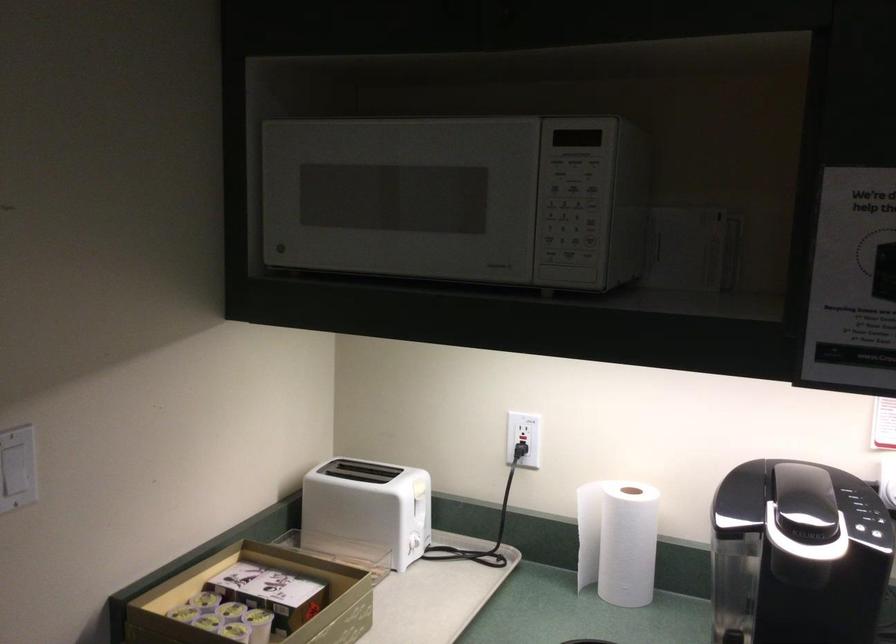
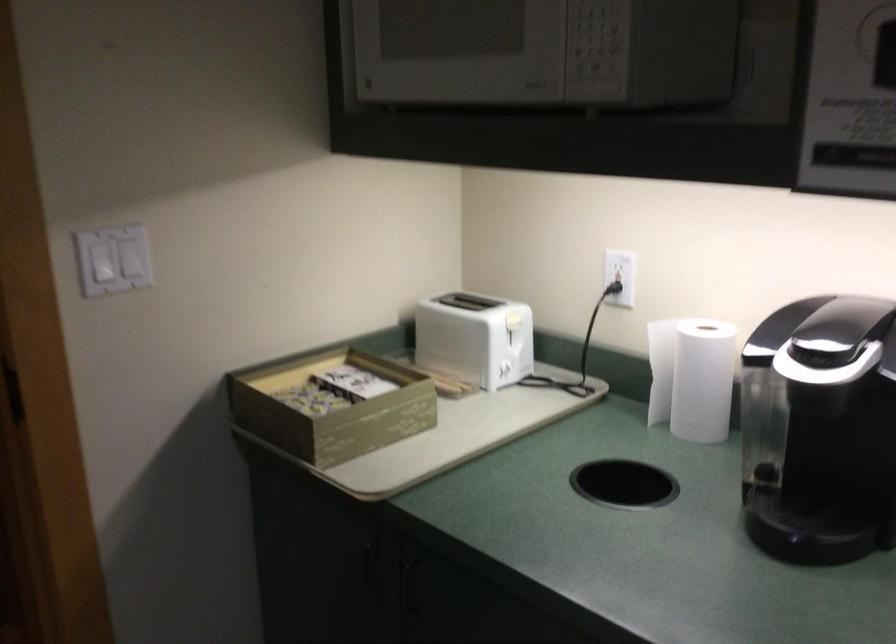
Where in the second image is the point corresponding to (x=522, y=451) from the first image?

(613, 288)